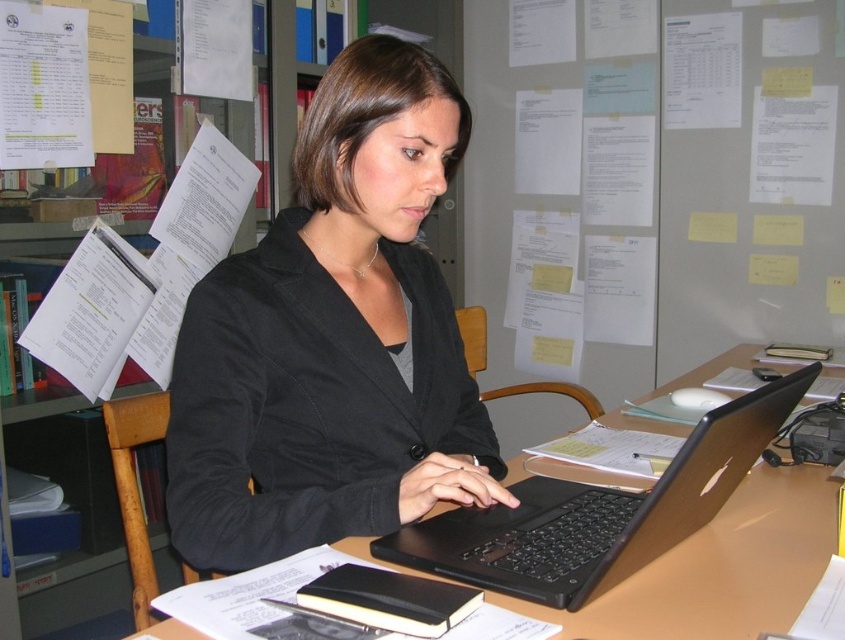
You are an office assistant who needs to place a new folder on the desk. The folder must be placed between the black matte blazer at center and the black plastic laptop at center. Considering their heights, which object should the folder be placed closer to?

The folder should be placed closer to the black plastic laptop at center because the black matte blazer at center is much taller than the black plastic laptop at center, so placing the folder near the shorter object would allow better visibility and accessibility.

You are an office assistant who needs to pack the black matte blazer at center and the black plastic laptop at center into a bag. The bag can only hold one item. Which item should you choose to fit into the bag?

The black plastic laptop at center should be chosen because the black matte blazer at center is larger in size than the black plastic laptop at center, so the laptop is smaller and more likely to fit into the bag.

You are standing at the point labeled point (519, 529) and want to move to the point labeled point (380, 129). Given that you can only move forward in a straight line, will you be able to reach the second point without any obstacles?

Point (380, 129) is behind point (519, 529), so if you move forward in a straight line from point (519, 529), you will not be able to reach point (380, 129) as it is located behind your starting position.